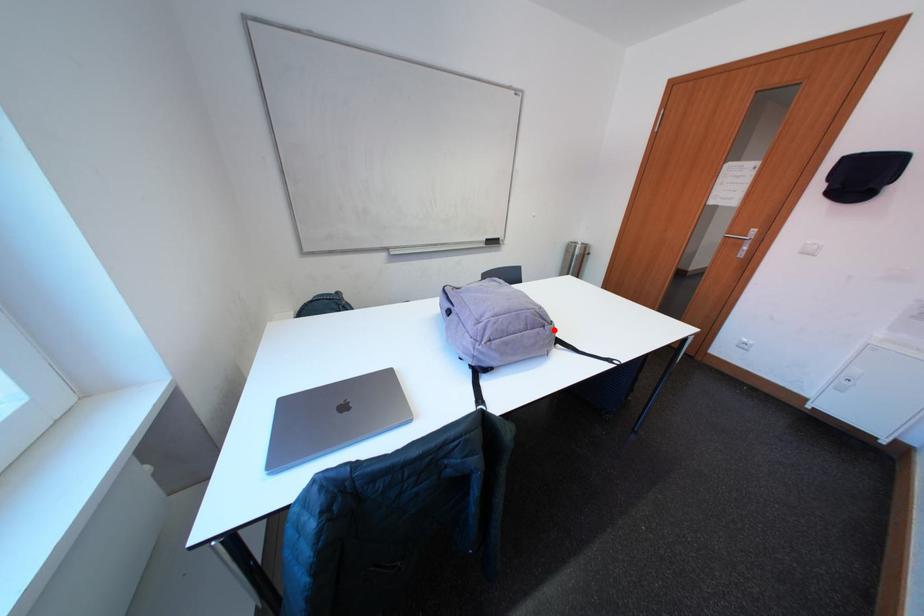
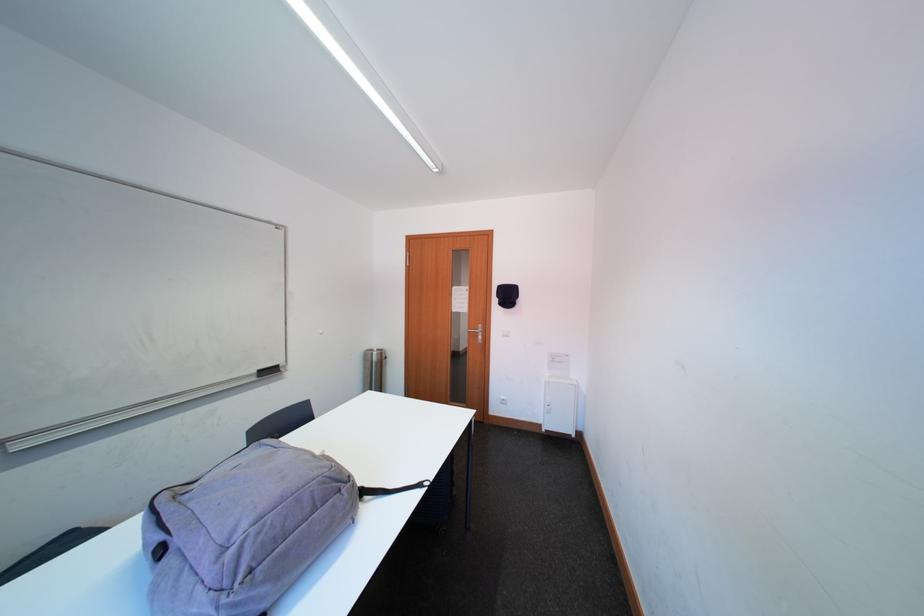
Question: I am providing you with two images of the same scene from different viewpoints. In image1, a red point is highlighted. Considering the same 3D point in image2, which of the following is correct?

Choices:
 (A) It is closer
 (B) It is farther

Answer: (A)